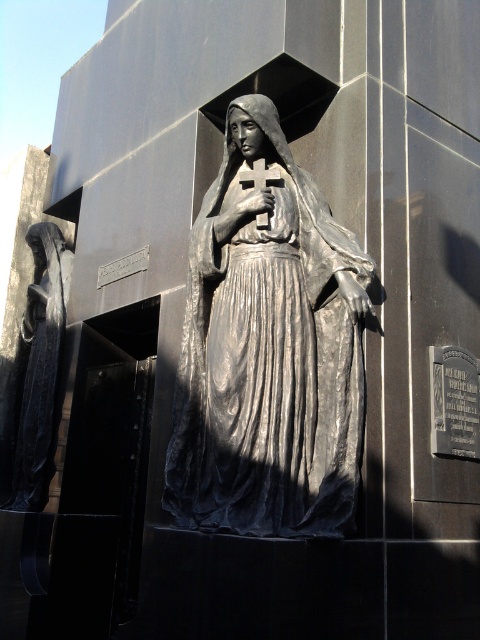
Does polished bronze statue at center appear on the left side of polished bronze robe at left?

Incorrect, polished bronze statue at center is not on the left side of polished bronze robe at left.

Is the position of polished bronze statue at center less distant than that of polished bronze robe at left?

Yes, it is in front of polished bronze robe at left.

In order to click on polished bronze statue at center in this screenshot , I will do `click(267, 349)`.

Between point (229, 196) and point (259, 216), which one is positioned behind?

The point (229, 196) is more distant.

Is polished bronze statue at center wider than metallic cross at center?

Yes, polished bronze statue at center is wider than metallic cross at center.

Who is more distant from viewer, (x=266, y=314) or (x=250, y=172)?

The point (x=250, y=172) is more distant.

This screenshot has width=480, height=640. What are the coordinates of `polished bronze statue at center` in the screenshot? It's located at (x=267, y=349).

Can you confirm if polished bronze robe at left is taller than metallic cross at center?

Indeed, polished bronze robe at left has a greater height compared to metallic cross at center.

The width and height of the screenshot is (480, 640). Describe the element at coordinates (35, 376) in the screenshot. I see `polished bronze robe at left` at that location.

Measure the distance between point (26, 356) and camera.

Point (26, 356) is 23.30 feet away from camera.

Locate an element on the screen. This screenshot has width=480, height=640. polished bronze robe at left is located at coordinates (35, 376).